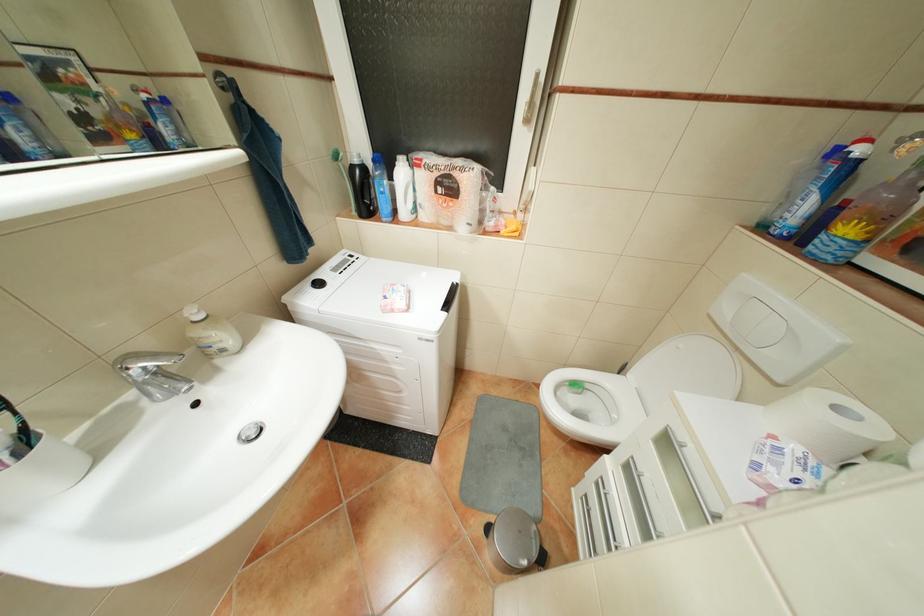
At what (x,y) coordinates should I click in order to perform the action: click on cleaning bottle. Please return your answer as a coordinate pair (x, y). The image size is (924, 616). Looking at the image, I should click on (382, 188).